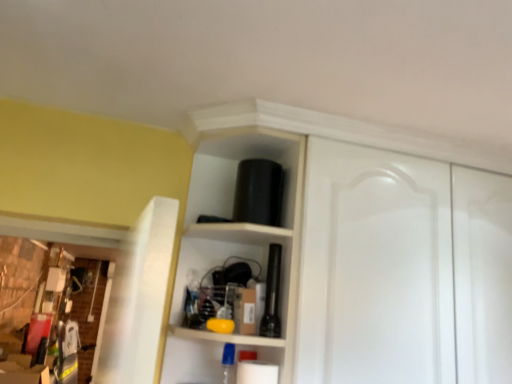
Measure the distance between point (265, 330) and camera.

The depth of point (265, 330) is 1.14 meters.

At what (x,y) coordinates should I click in order to perform the action: click on black matte flashlight at center. Please return your answer as a coordinate pair (x, y). Looking at the image, I should click on (272, 294).

The image size is (512, 384). Describe the element at coordinates (272, 294) in the screenshot. I see `black matte flashlight at center` at that location.

At what (x,y) coordinates should I click in order to perform the action: click on white matte cabinet at upper center. Please return your answer as a coordinate pair (x, y). The width and height of the screenshot is (512, 384). Looking at the image, I should click on (352, 254).

This screenshot has height=384, width=512. Describe the element at coordinates (352, 254) in the screenshot. I see `white matte cabinet at upper center` at that location.

The width and height of the screenshot is (512, 384). In order to click on black matte flashlight at center in this screenshot , I will do `click(272, 294)`.

Which object is positioned more to the right, black matte flashlight at center or white matte cabinet at upper center?

white matte cabinet at upper center is more to the right.

Which object is further away from the camera, black matte flashlight at center or white matte cabinet at upper center?

black matte flashlight at center is more distant.

Considering the positions of points (279, 257) and (175, 286), is point (279, 257) closer to camera compared to point (175, 286)?

Yes, point (279, 257) is closer to viewer.

From the image's perspective, is black matte flashlight at center over white matte cabinet at upper center?

No, from the image's perspective, black matte flashlight at center is not on top of white matte cabinet at upper center.

From a real-world perspective, is black matte flashlight at center physically located above or below white matte cabinet at upper center?

Clearly, from a real-world perspective, black matte flashlight at center is below white matte cabinet at upper center.

Does black matte flashlight at center have a greater width compared to white matte cabinet at upper center?

No.

Is black matte flashlight at center shorter than white matte cabinet at upper center?

Yes, black matte flashlight at center is shorter than white matte cabinet at upper center.

In terms of size, does black matte flashlight at center appear bigger or smaller than white matte cabinet at upper center?

In the image, black matte flashlight at center appears to be smaller than white matte cabinet at upper center.

Is black matte flashlight at center outside of white matte cabinet at upper center?

No, black matte flashlight at center is inside or overlapping with white matte cabinet at upper center.

Would you say black matte flashlight at center is a long distance from white matte cabinet at upper center?

No, black matte flashlight at center is in close proximity to white matte cabinet at upper center.

Is black matte flashlight at center oriented towards white matte cabinet at upper center?

Yes, black matte flashlight at center is facing white matte cabinet at upper center.

From the picture: How many degrees apart are the facing directions of black matte flashlight at center and white matte cabinet at upper center?

The facing directions of black matte flashlight at center and white matte cabinet at upper center are 2.98 degrees apart.

What are the coordinates of `bottle that appears behind the white matte cabinet at upper center` in the screenshot? It's located at (272, 294).

Is white matte cabinet at upper center to the left of black matte flashlight at center from the viewer's perspective?

No, white matte cabinet at upper center is not to the left of black matte flashlight at center.

Does white matte cabinet at upper center lie in front of black matte flashlight at center?

Yes.

Is point (236, 343) positioned before point (269, 267)?

Yes, point (236, 343) is closer to viewer.

From the image's perspective, which one is positioned higher, white matte cabinet at upper center or black matte flashlight at center?

white matte cabinet at upper center, from the image's perspective.

From a real-world perspective, relative to black matte flashlight at center, is white matte cabinet at upper center vertically above or below?

From a real-world perspective, white matte cabinet at upper center is physically above black matte flashlight at center.

Can you confirm if white matte cabinet at upper center is thinner than black matte flashlight at center?

No.

In the scene shown: Between white matte cabinet at upper center and black matte flashlight at center, which one has more height?

With more height is white matte cabinet at upper center.

Who is bigger, white matte cabinet at upper center or black matte flashlight at center?

Bigger between the two is white matte cabinet at upper center.

Is white matte cabinet at upper center situated inside black matte flashlight at center or outside?

white matte cabinet at upper center is located beyond the bounds of black matte flashlight at center.

Does white matte cabinet at upper center touch black matte flashlight at center?

There is a gap between white matte cabinet at upper center and black matte flashlight at center.

Is white matte cabinet at upper center positioned with its back to black matte flashlight at center?

Absolutely, white matte cabinet at upper center is directed away from black matte flashlight at center.

How much distance is there between white matte cabinet at upper center and black matte flashlight at center?

white matte cabinet at upper center is 13.86 inches from black matte flashlight at center.

There is a black matte flashlight at center. Identify the location of dresser above it (from a real-world perspective). Image resolution: width=512 pixels, height=384 pixels. (352, 254).

At what (x,y) coordinates should I click in order to perform the action: click on dresser that appears above the black matte flashlight at center (from the image's perspective). Please return your answer as a coordinate pair (x, y). Looking at the image, I should click on (352, 254).

Where is `bottle below the white matte cabinet at upper center (from a real-world perspective)`? bottle below the white matte cabinet at upper center (from a real-world perspective) is located at coordinates (272, 294).